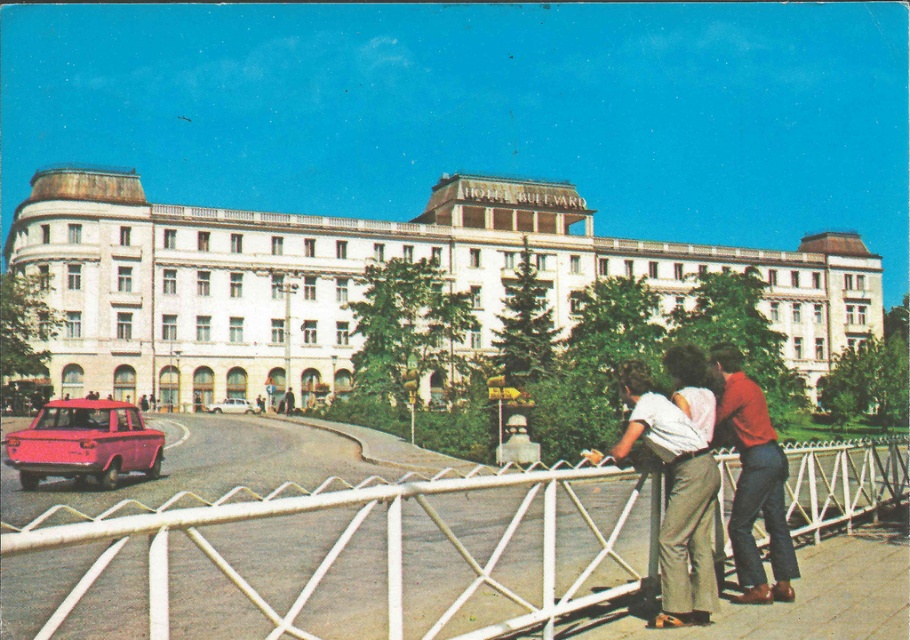
You are a photographer planning to take a wide shot of the Hotel Boulevard. You need to include both the white metal fence at lower center and the matte pink sedan at lower left in your frame. Based on their sizes, which object will occupy more space in the photo?

The white metal fence at lower center will occupy more space in the photo because its width is larger than that of the matte pink sedan at lower left.

You are standing at the point labeled point [48,440] and want to walk to the entrance of Hotel Boulevard. Is the point labeled point [288,589] located between you and the hotel entrance?

Yes, the point labeled point [288,589] is located between you and the hotel entrance because it is in front of point [48,440], which is your current position.